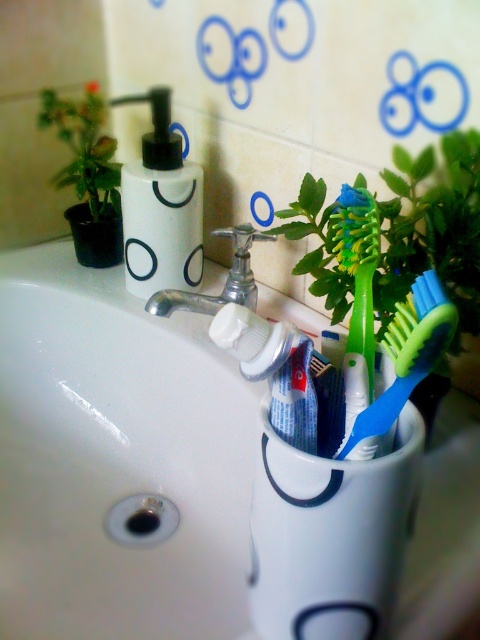
Question: Which of the following is the farthest from the observer?

Choices:
 (A) (385, 316)
 (B) (324, 374)
 (C) (308, 376)

Answer: (A)

Question: Does green matte plant at upper right appear on the right side of blue matte toothpaste at center?

Choices:
 (A) no
 (B) yes

Answer: (B)

Question: Is white matte soap dispenser at upper left wider than green rubber toothbrush at center?

Choices:
 (A) no
 (B) yes

Answer: (B)

Question: Which object is closer to the camera taking this photo?

Choices:
 (A) blue matte toothpaste at center
 (B) white matte toothpaste at center
 (C) green matte plant at upper left

Answer: (B)

Question: Which of the following is the closest to the observer?

Choices:
 (A) green plastic toothbrush at center
 (B) green matte plant at upper left

Answer: (A)

Question: Does white matte toothpaste at center appear under green rubber toothbrush at center?

Choices:
 (A) yes
 (B) no

Answer: (A)